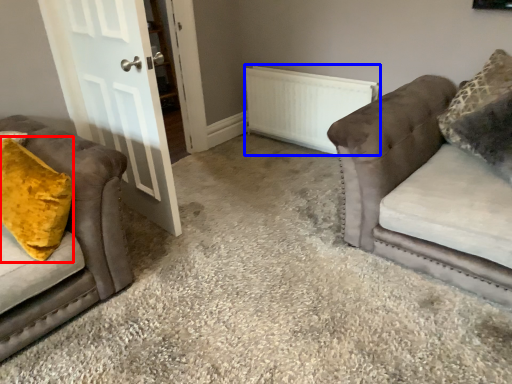
Question: Which of the following is the farthest to the observer, throw pillow (highlighted by a red box) or radiator (highlighted by a blue box)?

Choices:
 (A) throw pillow
 (B) radiator

Answer: (B)